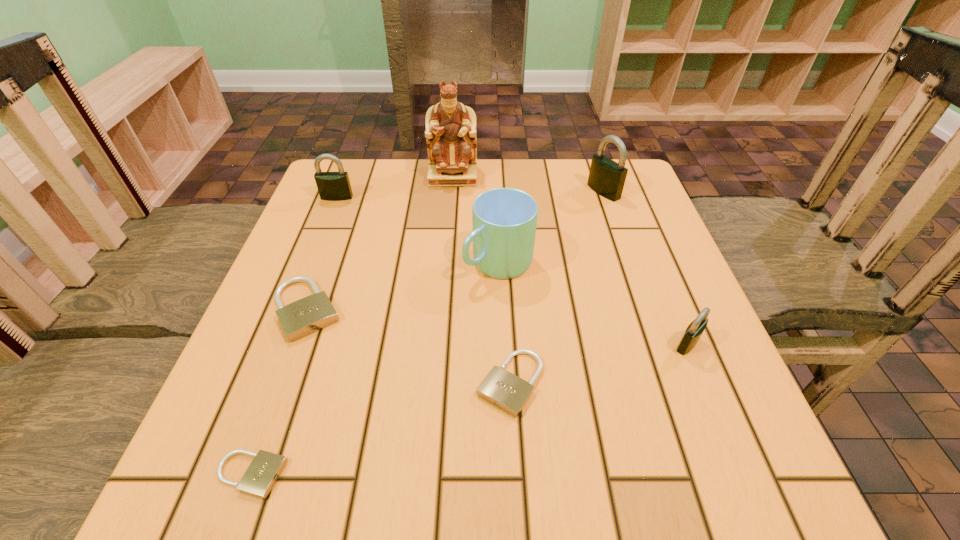
The width and height of the screenshot is (960, 540). What are the coordinates of `blank region between the tallest padlock and the fourth tallest padlock` in the screenshot? It's located at [455, 251].

Identify which object is located as the third nearest to the fourth tallest padlock. Please provide its 2D coordinates. Your answer should be formatted as a tuple, i.e. [(x, y)], where the tuple contains the x and y coordinates of a point satisfying the conditions above.

[(501, 388)]

Choose which object is the fourth nearest neighbor to the tallest object. Please provide its 2D coordinates. Your answer should be formatted as a tuple, i.e. [(x, y)], where the tuple contains the x and y coordinates of a point satisfying the conditions above.

[(300, 318)]

Find the location of a particular element. Image resolution: width=960 pixels, height=540 pixels. padlock identified as the second closest to the tallest padlock is located at coordinates (501, 388).

Locate an element on the screen. padlock that is the third closest to the second smallest black padlock is located at coordinates (606, 177).

Select which black padlock appears as the third closest to the second smallest beige padlock. Please provide its 2D coordinates. Your answer should be formatted as a tuple, i.e. [(x, y)], where the tuple contains the x and y coordinates of a point satisfying the conditions above.

[(332, 186)]

Locate an element on the screen. black padlock that stands as the closest to the fourth tallest padlock is located at coordinates (332, 186).

The height and width of the screenshot is (540, 960). Identify the location of beige padlock that is the closest to the tallest padlock. (501, 388).

You are a GUI agent. You are given a task and a screenshot of the screen. Output one action in this format:
    pyautogui.click(x=<x>, y=<y>)
    Task: Click on the beige padlock that is the closest one to the farthest beige padlock
    
    Given the screenshot: What is the action you would take?
    pyautogui.click(x=260, y=477)

Where is `free space that satisfies the following two spatial constraints: 1. on the front-facing side of the figurine; 2. on the left side of the second smallest beige padlock`? free space that satisfies the following two spatial constraints: 1. on the front-facing side of the figurine; 2. on the left side of the second smallest beige padlock is located at coordinates pyautogui.click(x=437, y=383).